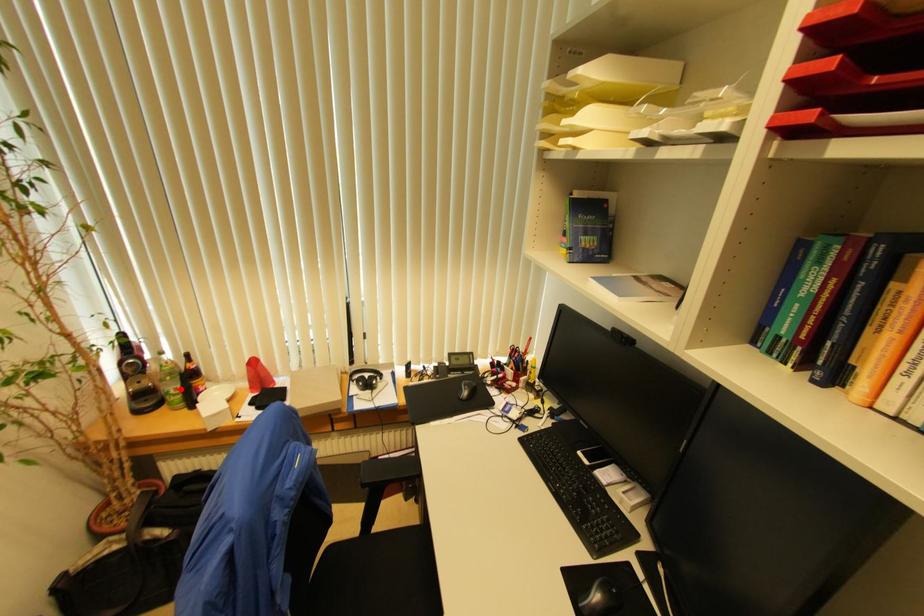
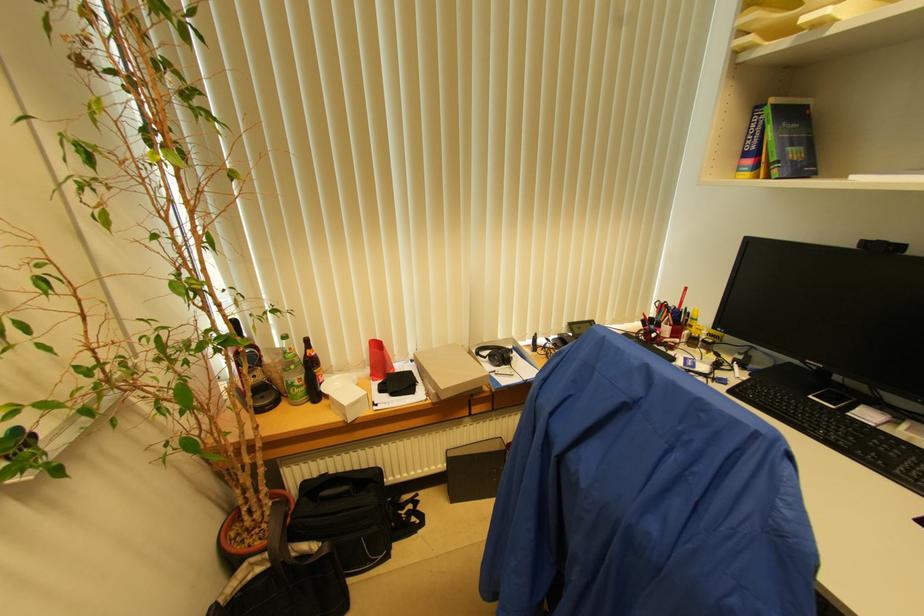
Find the pixel in the second image that matches the highlighted location in the first image.

(304, 379)